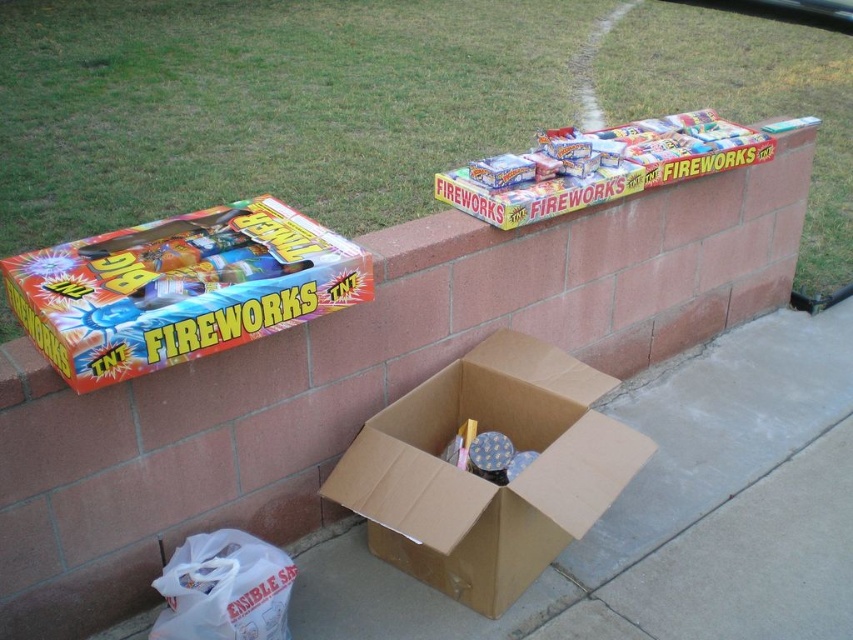
Can you confirm if brown cardboard box at center is bigger than orange glossy fireworks box at left?

Yes, brown cardboard box at center is bigger than orange glossy fireworks box at left.

Can you confirm if brown cardboard box at center is positioned below orange glossy fireworks box at left?

Yes.

Is point (515, 413) positioned in front of point (136, 310)?

No, (515, 413) is further to viewer.

What are the coordinates of `brown cardboard box at center` in the screenshot? It's located at point(485,480).

Between brown cardboard box at center and white plastic bag at lower left, which one appears on the left side from the viewer's perspective?

white plastic bag at lower left is more to the left.

Based on the photo, which of these two, brown cardboard box at center or white plastic bag at lower left, stands shorter?

With less height is white plastic bag at lower left.

What do you see at coordinates (485, 480) in the screenshot?
I see `brown cardboard box at center` at bounding box center [485, 480].

At what (x,y) coordinates should I click in order to perform the action: click on brown cardboard box at center. Please return your answer as a coordinate pair (x, y). Looking at the image, I should click on (485, 480).

Describe the element at coordinates (625, 486) in the screenshot. I see `brown cardboard box at lower center` at that location.

Where is `brown cardboard box at lower center`? This screenshot has width=853, height=640. brown cardboard box at lower center is located at coordinates (625, 486).

This screenshot has width=853, height=640. In order to click on brown cardboard box at lower center in this screenshot , I will do `click(625, 486)`.